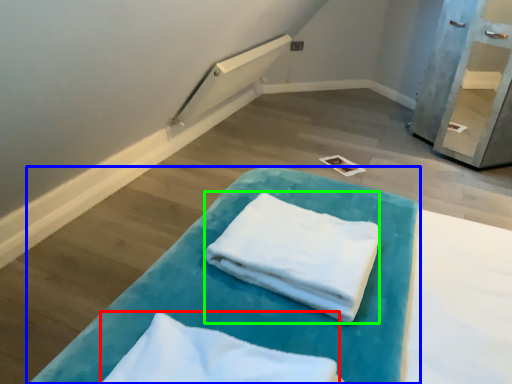
Question: Which object is positioned closest to cloth (highlighted by a red box)? Select from furniture (highlighted by a blue box) and cloth (highlighted by a green box).

Choices:
 (A) furniture
 (B) cloth

Answer: (A)